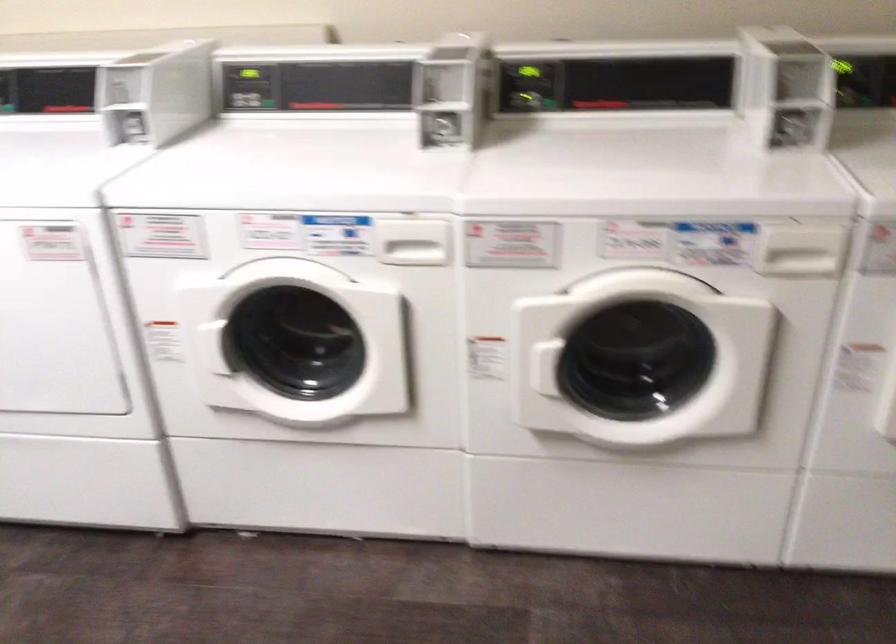
You are a GUI agent. You are given a task and a screenshot of the screen. Output one action in this format:
    pyautogui.click(x=<x>, y=<y>)
    Task: Click on the white door handle
    The image size is (896, 644).
    Given the screenshot: What is the action you would take?
    pyautogui.click(x=409, y=251)